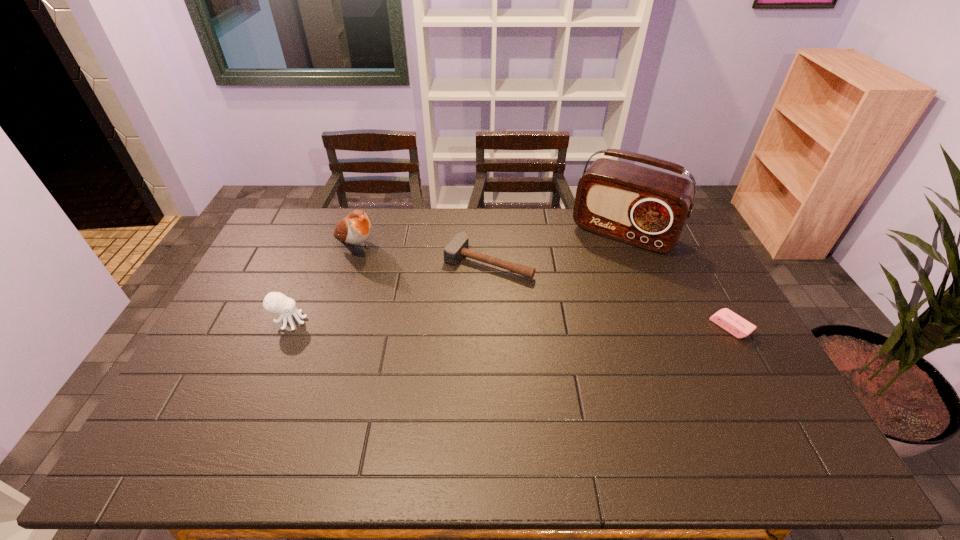
This screenshot has height=540, width=960. What are the coordinates of `object located at the left edge` in the screenshot? It's located at (275, 302).

Locate an element on the screen. This screenshot has width=960, height=540. eraser present at the right edge is located at coordinates (728, 320).

Locate an element on the screen. The width and height of the screenshot is (960, 540). radio receiver that is at the right edge is located at coordinates (647, 208).

The image size is (960, 540). I want to click on object at the far right corner, so click(x=647, y=208).

I want to click on free location at the far edge of the desktop, so click(606, 240).

The width and height of the screenshot is (960, 540). What are the coordinates of `free space at the near edge` in the screenshot? It's located at (461, 403).

Find the location of a particular element. vacant region at the right edge of the desktop is located at coordinates (727, 350).

The width and height of the screenshot is (960, 540). What are the coordinates of `vacant space at the far left corner of the desktop` in the screenshot? It's located at (274, 247).

At what (x,y) coordinates should I click in order to perform the action: click on unoccupied area between the octopus and the radio receiver. Please return your answer as a coordinate pair (x, y). Image resolution: width=960 pixels, height=540 pixels. Looking at the image, I should click on (457, 277).

Where is `vacant space that is in between the tallest object and the eraser`? vacant space that is in between the tallest object and the eraser is located at coordinates point(677,280).